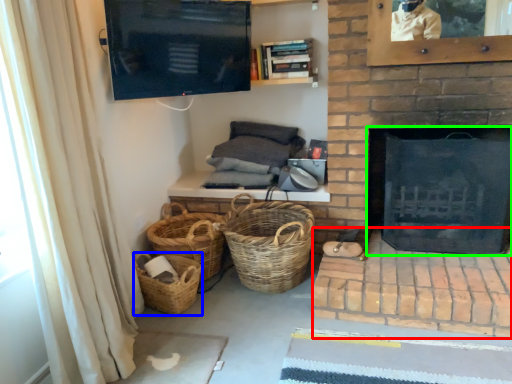
Question: Considering the real-world distances, which object is closest to brickwork (highlighted by a red box)? basket (highlighted by a blue box) or fireplace (highlighted by a green box).

Choices:
 (A) basket
 (B) fireplace

Answer: (B)